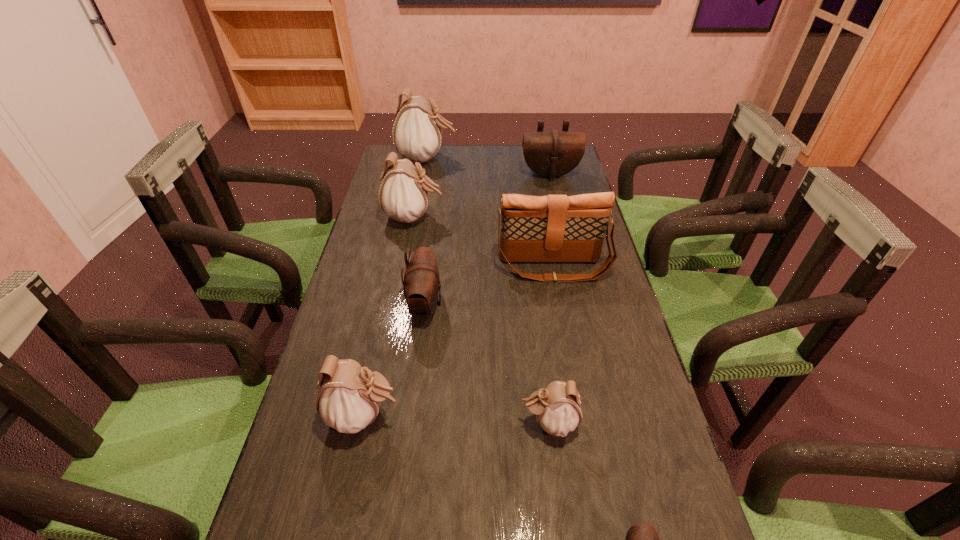
Image resolution: width=960 pixels, height=540 pixels. In order to click on pouch that is at the right edge in this screenshot , I will do `click(551, 154)`.

Identify the location of object that is positioned at the far left corner. (417, 131).

Locate an element on the screen. The image size is (960, 540). object that is at the far right corner is located at coordinates (551, 154).

The width and height of the screenshot is (960, 540). I want to click on vacant area at the far edge, so click(x=474, y=173).

Identify the location of blank area at the left edge. (386, 219).

Identify the location of free spot at the right edge of the desktop. (617, 467).

You are a GUI agent. You are given a task and a screenshot of the screen. Output one action in this format:
    pyautogui.click(x=<x>, y=<y>)
    Task: Click on the unoccupied area between the farthest brown pouch and the rightmost white pouch
    The width and height of the screenshot is (960, 540).
    Given the screenshot: What is the action you would take?
    coord(549,298)

Where is `empty space that is in between the second farthest brown pouch and the rightmost white pouch`? empty space that is in between the second farthest brown pouch and the rightmost white pouch is located at coordinates (487, 363).

Locate an element on the screen. The height and width of the screenshot is (540, 960). vacant area that lies between the smallest white pouch and the second smallest brown pouch is located at coordinates (487, 363).

The image size is (960, 540). I want to click on free space between the third biggest white pouch and the second smallest brown pouch, so click(395, 360).